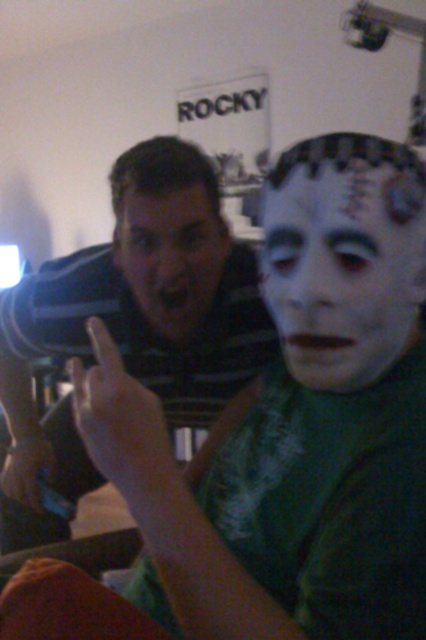
Can you confirm if striped shirt at center is positioned above white matte face at center?

Actually, striped shirt at center is below white matte face at center.

Locate an element on the screen. Image resolution: width=426 pixels, height=640 pixels. striped shirt at center is located at coordinates (131, 324).

Where is `striped shirt at center`? The width and height of the screenshot is (426, 640). striped shirt at center is located at coordinates (131, 324).

I want to click on striped shirt at center, so click(x=131, y=324).

Which is below, striped shirt at center or matte black face at center?

striped shirt at center is below.

Does point (233, 289) lie in front of point (173, 298)?

No.

Describe the element at coordinates (131, 324) in the screenshot. I see `striped shirt at center` at that location.

Identify the location of striped shirt at center. (131, 324).

Between point (270, 224) and point (187, 257), which one is positioned behind?

Point (187, 257)

Which is behind, point (261, 200) or point (154, 244)?

Positioned behind is point (261, 200).

Find the location of a particular element. This screenshot has height=640, width=426. white matte face at center is located at coordinates 342,268.